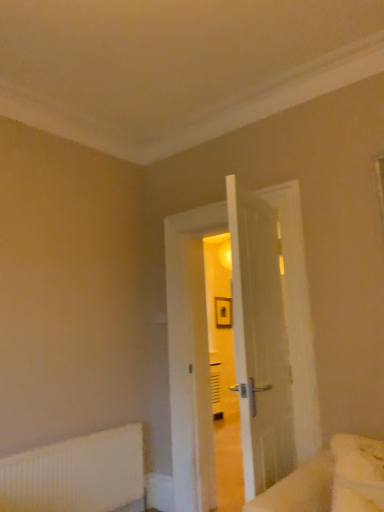
Question: Does white fluffy bed at lower right have a greater width compared to white wooden door at center?

Choices:
 (A) yes
 (B) no

Answer: (B)

Question: Is white fluffy bed at lower right oriented away from white wooden door at center?

Choices:
 (A) no
 (B) yes

Answer: (A)

Question: From the image's perspective, would you say white fluffy bed at lower right is positioned over white wooden door at center?

Choices:
 (A) no
 (B) yes

Answer: (A)

Question: From a real-world perspective, does white fluffy bed at lower right stand above white wooden door at center?

Choices:
 (A) no
 (B) yes

Answer: (A)

Question: From a real-world perspective, does white fluffy bed at lower right sit lower than white wooden door at center?

Choices:
 (A) no
 (B) yes

Answer: (B)

Question: In the image, is white ribbed radiator at lower left positioned in front of or behind white fluffy bed at lower right?

Choices:
 (A) front
 (B) behind

Answer: (B)

Question: In terms of size, does white ribbed radiator at lower left appear bigger or smaller than white fluffy bed at lower right?

Choices:
 (A) small
 (B) big

Answer: (B)

Question: From a real-world perspective, relative to white fluffy bed at lower right, is white ribbed radiator at lower left vertically above or below?

Choices:
 (A) below
 (B) above

Answer: (A)

Question: Considering the relative positions of white ribbed radiator at lower left and white fluffy bed at lower right in the image provided, is white ribbed radiator at lower left to the left or to the right of white fluffy bed at lower right?

Choices:
 (A) left
 (B) right

Answer: (A)

Question: Is white wooden door at center bigger or smaller than white ribbed radiator at lower left?

Choices:
 (A) small
 (B) big

Answer: (B)

Question: Considering the relative positions of white wooden door at center and white ribbed radiator at lower left in the image provided, is white wooden door at center to the left or to the right of white ribbed radiator at lower left?

Choices:
 (A) left
 (B) right

Answer: (B)

Question: Is point (288, 201) closer or farther from the camera than point (3, 478)?

Choices:
 (A) closer
 (B) farther

Answer: (B)

Question: In terms of height, does white wooden door at center look taller or shorter compared to white ribbed radiator at lower left?

Choices:
 (A) tall
 (B) short

Answer: (A)

Question: Would you say white ribbed radiator at lower left is to the left or to the right of white wooden door at center in the picture?

Choices:
 (A) left
 (B) right

Answer: (A)

Question: Considering the positions of point (94, 484) and point (188, 312), is point (94, 484) closer or farther from the camera than point (188, 312)?

Choices:
 (A) farther
 (B) closer

Answer: (B)